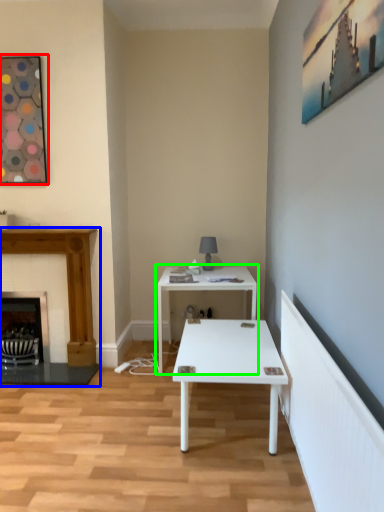
Question: Estimate the real-world distances between objects in this image. Which object is closer to picture frame (highlighted by a red box), fireplace (highlighted by a blue box) or table (highlighted by a green box)?

Choices:
 (A) fireplace
 (B) table

Answer: (A)